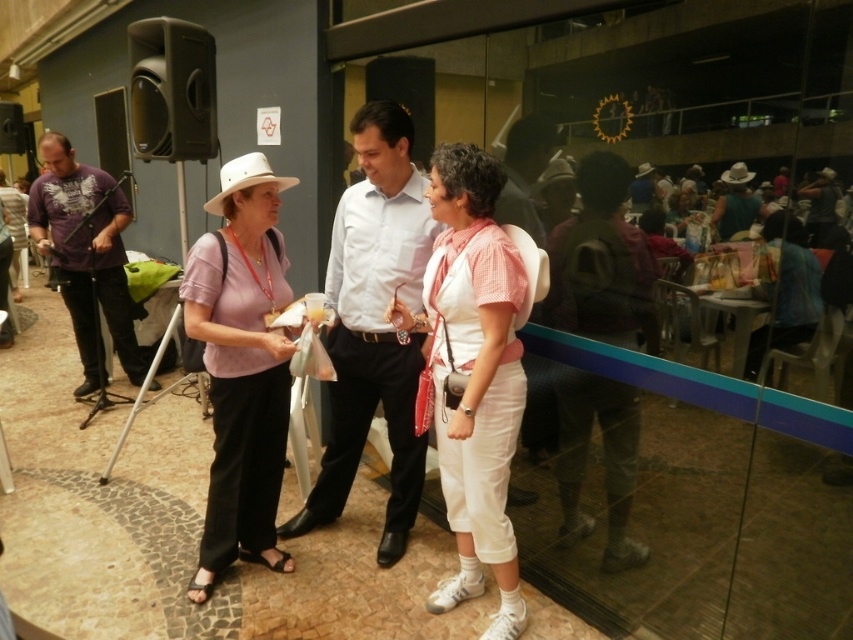
Is light blue shirt at center bigger than purple cotton shirt at left?

No, light blue shirt at center is not bigger than purple cotton shirt at left.

Can you confirm if light blue shirt at center is positioned below purple cotton shirt at left?

Yes, light blue shirt at center is below purple cotton shirt at left.

At what (x,y) coordinates should I click in order to perform the action: click on light blue shirt at center. Please return your answer as a coordinate pair (x, y). Image resolution: width=853 pixels, height=640 pixels. Looking at the image, I should click on (374, 324).

Find the location of a particular element. The image size is (853, 640). light blue shirt at center is located at coordinates (374, 324).

Between white cotton shirt at center and matte pink shirt at center, which one appears on the right side from the viewer's perspective?

white cotton shirt at center is more to the right.

Which is in front, point (509, 554) or point (207, 508)?

Point (509, 554) is in front.

The image size is (853, 640). What are the coordinates of `white cotton shirt at center` in the screenshot? It's located at (473, 376).

Locate an element on the screen. The height and width of the screenshot is (640, 853). white cotton shirt at center is located at coordinates (473, 376).

Is point (264, 332) positioned before point (76, 163)?

Yes, point (264, 332) is in front of point (76, 163).

Is point (196, 301) behind point (82, 317)?

That is False.

Which is in front, point (225, 522) or point (84, 218)?

Point (225, 522)

Locate an element on the screen. Image resolution: width=853 pixels, height=640 pixels. matte pink shirt at center is located at coordinates (241, 368).